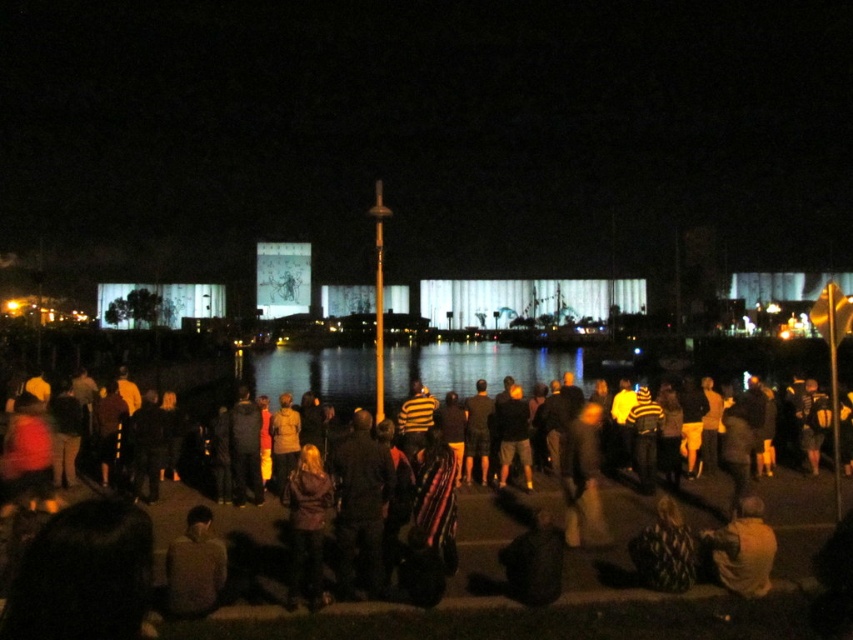
Question: Which point appears closest to the camera in this image?

Choices:
 (A) (485, 493)
 (B) (531, 355)

Answer: (A)

Question: Among these objects, which one is farthest from the camera?

Choices:
 (A) transparent glass water at center
 (B) dark clothing crowd at center

Answer: (A)

Question: Is dark clothing crowd at center to the left of transparent glass water at center from the viewer's perspective?

Choices:
 (A) yes
 (B) no

Answer: (B)

Question: From the image, what is the correct spatial relationship of dark clothing crowd at center in relation to transparent glass water at center?

Choices:
 (A) right
 (B) left

Answer: (A)

Question: Can you confirm if dark clothing crowd at center is positioned to the left of transparent glass water at center?

Choices:
 (A) no
 (B) yes

Answer: (A)